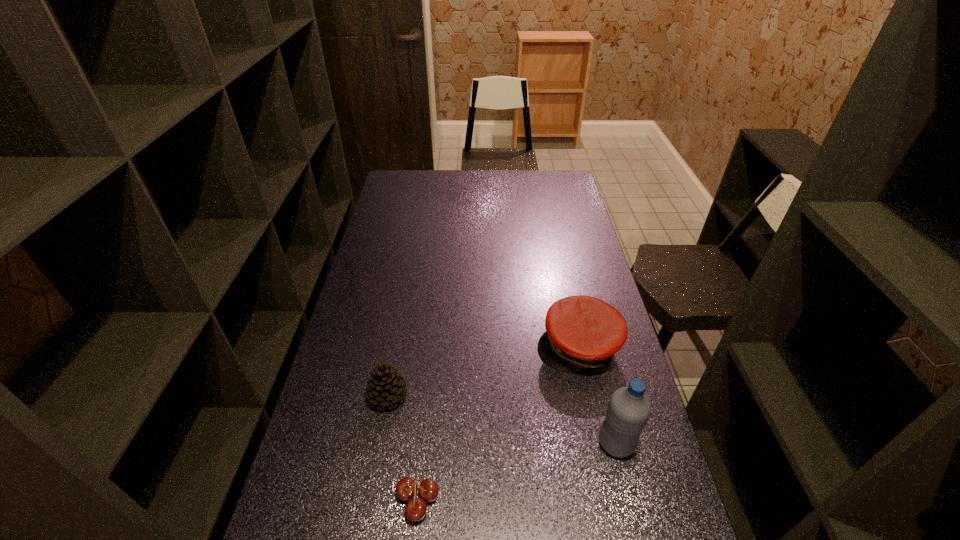
At what (x,y) coordinates should I click in order to perform the action: click on cap present at the right edge. Please return your answer as a coordinate pair (x, y). This screenshot has width=960, height=540. Looking at the image, I should click on (582, 332).

Where is `vacant space at the far edge of the desktop`? This screenshot has height=540, width=960. vacant space at the far edge of the desktop is located at coordinates (479, 190).

In order to click on vacant space at the near edge of the desktop in this screenshot , I will do `click(414, 523)`.

The height and width of the screenshot is (540, 960). What are the coordinates of `blank area at the left edge` in the screenshot? It's located at (356, 435).

Locate an element on the screen. This screenshot has height=540, width=960. vacant area at the right edge of the desktop is located at coordinates (610, 500).

In the image, there is a desktop. What are the coordinates of `blank space at the near left corner` in the screenshot? It's located at (341, 538).

In order to click on free location at the far right corner in this screenshot , I will do `click(547, 183)`.

Identify the location of vacant area at the near right corner of the desktop. This screenshot has width=960, height=540. (624, 520).

This screenshot has height=540, width=960. What are the coordinates of `free space between the tallest object and the nearest object` in the screenshot? It's located at click(517, 470).

Identify the location of vacant point located between the pinecone and the water bottle. This screenshot has width=960, height=540. (502, 419).